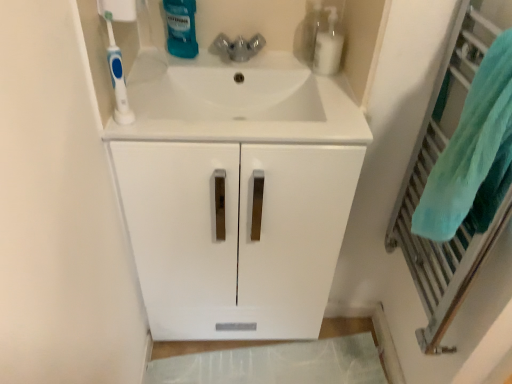
Question: Considering the positions of teal soft towel at right and white glossy sink at center in the image, is teal soft towel at right bigger or smaller than white glossy sink at center?

Choices:
 (A) small
 (B) big

Answer: (A)

Question: From their relative heights in the image, would you say teal soft towel at right is taller or shorter than white glossy sink at center?

Choices:
 (A) short
 (B) tall

Answer: (B)

Question: Which is nearer to the clear plastic bottle at upper right, the 1th cleaning product positioned from the right?

Choices:
 (A) translucent plastic mouthwash at upper center, the first cleaning product positioned from the left
 (B) teal fabric towel at right
 (C) white glossy sink at center
 (D) blue plastic toothbrush at upper left
 (E) teal soft towel at right

Answer: (C)

Question: Considering the real-world distances, which object is closest to the blue plastic toothbrush at upper left?

Choices:
 (A) translucent plastic mouthwash at upper center, which is the second cleaning product in right-to-left order
 (B) clear plastic bottle at upper right, marked as the second cleaning product in a left-to-right arrangement
 (C) teal fabric towel at right
 (D) white glossy sink at center
 (E) teal soft towel at right

Answer: (D)